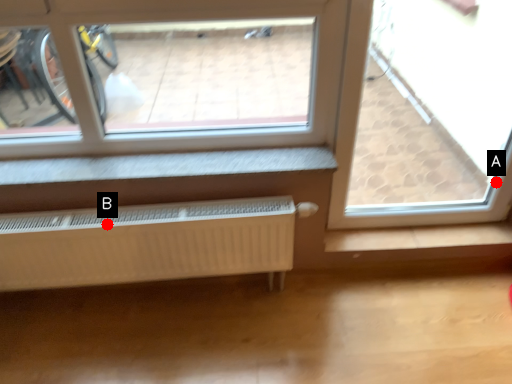
Question: Two points are circled on the image, labeled by A and B beside each circle. Which point is farther from the camera taking this photo?

Choices:
 (A) A is further
 (B) B is further

Answer: (A)